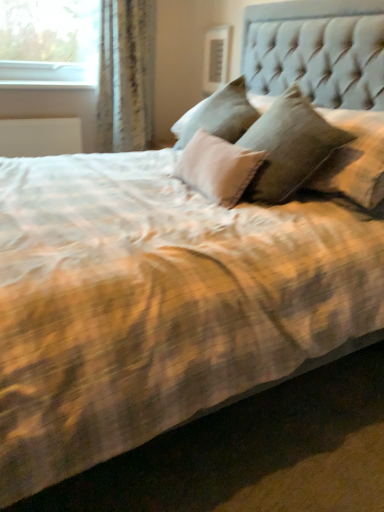
Question: Does white plastic window sill at upper left have a greater height compared to white textured curtain at upper left?

Choices:
 (A) yes
 (B) no

Answer: (B)

Question: Is white plastic window sill at upper left to the right of white textured curtain at upper left from the viewer's perspective?

Choices:
 (A) no
 (B) yes

Answer: (A)

Question: Considering the relative sizes of white plastic window sill at upper left and white textured curtain at upper left in the image provided, is white plastic window sill at upper left bigger than white textured curtain at upper left?

Choices:
 (A) no
 (B) yes

Answer: (A)

Question: From the image's perspective, would you say white plastic window sill at upper left is shown under white textured curtain at upper left?

Choices:
 (A) no
 (B) yes

Answer: (A)

Question: Is white plastic window sill at upper left smaller than white textured curtain at upper left?

Choices:
 (A) no
 (B) yes

Answer: (B)

Question: Is white plastic window sill at upper left oriented towards white textured curtain at upper left?

Choices:
 (A) yes
 (B) no

Answer: (B)

Question: From the image's perspective, is white textured curtain at upper left located beneath white plastic window sill at upper left?

Choices:
 (A) no
 (B) yes

Answer: (B)

Question: From the image's perspective, does white textured curtain at upper left appear higher than white plastic window sill at upper left?

Choices:
 (A) yes
 (B) no

Answer: (B)

Question: Considering the relative sizes of white textured curtain at upper left and white plastic window sill at upper left in the image provided, is white textured curtain at upper left wider than white plastic window sill at upper left?

Choices:
 (A) yes
 (B) no

Answer: (A)

Question: Does white textured curtain at upper left appear on the right side of white plastic window sill at upper left?

Choices:
 (A) no
 (B) yes

Answer: (B)

Question: Is the depth of white textured curtain at upper left greater than that of white plastic window sill at upper left?

Choices:
 (A) no
 (B) yes

Answer: (A)

Question: Would you say white plastic window sill at upper left is part of white textured curtain at upper left's contents?

Choices:
 (A) no
 (B) yes

Answer: (A)

Question: Looking at their shapes, would you say white textured curtain at upper left is wider or thinner than white plastic window sill at upper left?

Choices:
 (A) wide
 (B) thin

Answer: (A)